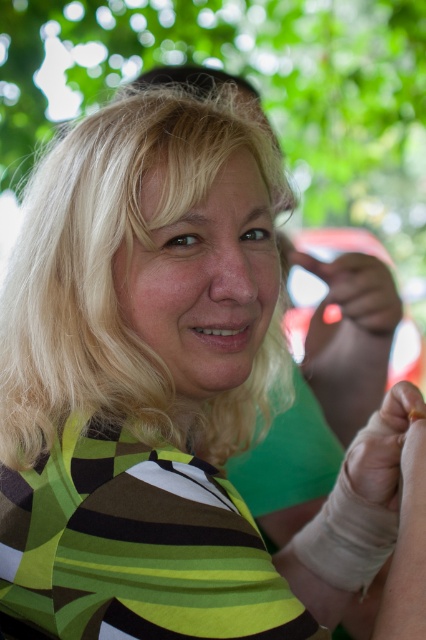
In the scene shown: You are a photographer adjusting your camera settings. You notice the blonde hair at center and the white smooth bandage at lower right in the frame. How far apart are these two elements in inches?

The blonde hair at center is 10.43 inches away from the white smooth bandage at lower right.

You are a photographer setting up a photo shoot in a garden. You have two items to place in the scene for the shoot. The items are the smooth white glove at center and the white smooth bandage at lower right. The client wants to know which item takes up more vertical space in the frame. Which one is taller?

The smooth white glove at center is much taller than the white smooth bandage at lower right, so the smooth white glove at center takes up more vertical space in the frame.

You are a photographer trying to capture a portrait of the person in the scene. The camera you are using has a focal length of 50mm. If you want to ensure that the green leafy tree at upper center does not appear in the background of your photo, what adjustment should you make to your camera position or settings?

To avoid capturing the green leafy tree at upper center in the background, you can adjust your camera position by moving closer to the subject, which reduces the field of view and helps exclude the tree from the frame. Alternatively, using a longer focal length would compress the perspective, making the background elements like the tree less prominent or possibly out of the frame entirely.